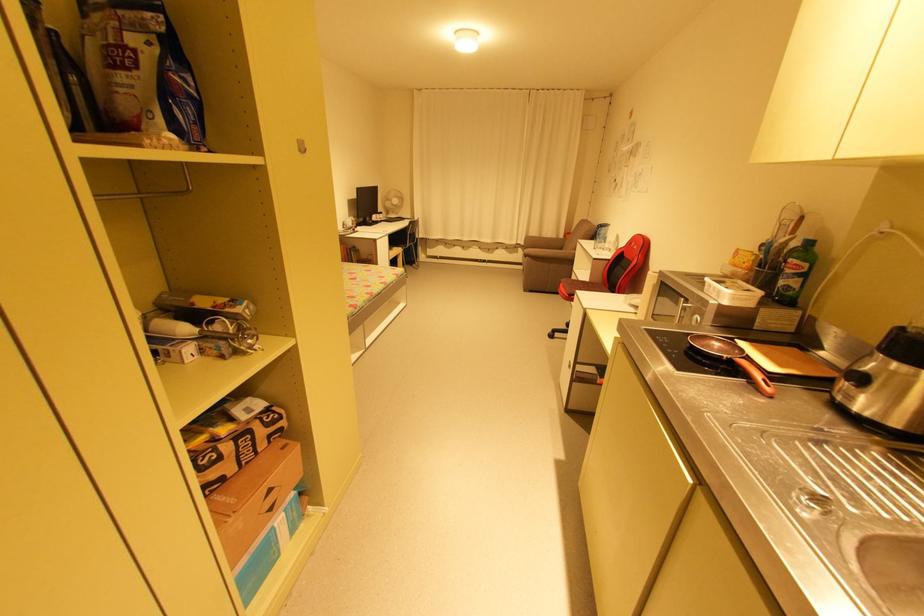
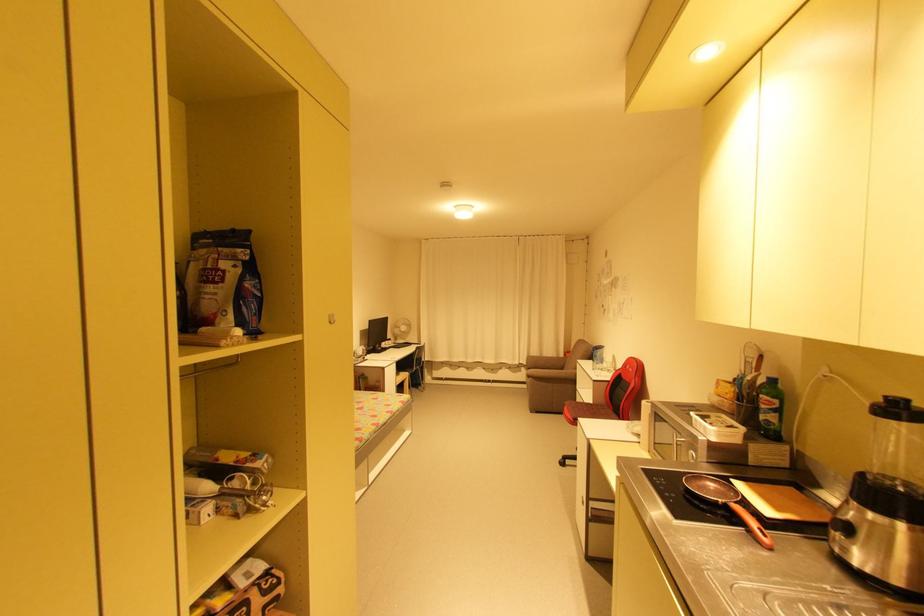
Where in the second image is the point corresponding to the point at 880,416 from the first image?

(878, 570)